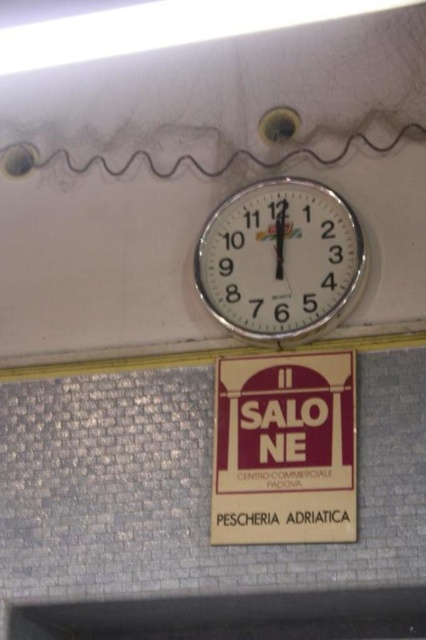
Question: Which object appears farthest from the camera in this image?

Choices:
 (A) matte brown sign at center
 (B) metallic clock at upper center

Answer: (B)

Question: Considering the relative positions of matte brown sign at center and metallic clock at upper center in the image provided, where is matte brown sign at center located with respect to metallic clock at upper center?

Choices:
 (A) above
 (B) below

Answer: (B)

Question: Does matte brown sign at center have a lesser width compared to metallic clock at upper center?

Choices:
 (A) no
 (B) yes

Answer: (B)

Question: Can you confirm if matte brown sign at center is bigger than metallic clock at upper center?

Choices:
 (A) no
 (B) yes

Answer: (A)